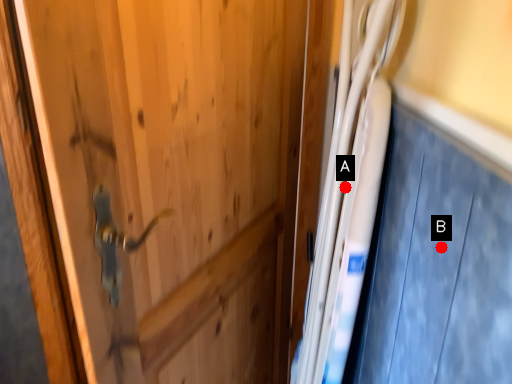
Question: Two points are circled on the image, labeled by A and B beside each circle. Which point is further to the camera?

Choices:
 (A) A is further
 (B) B is further

Answer: (A)